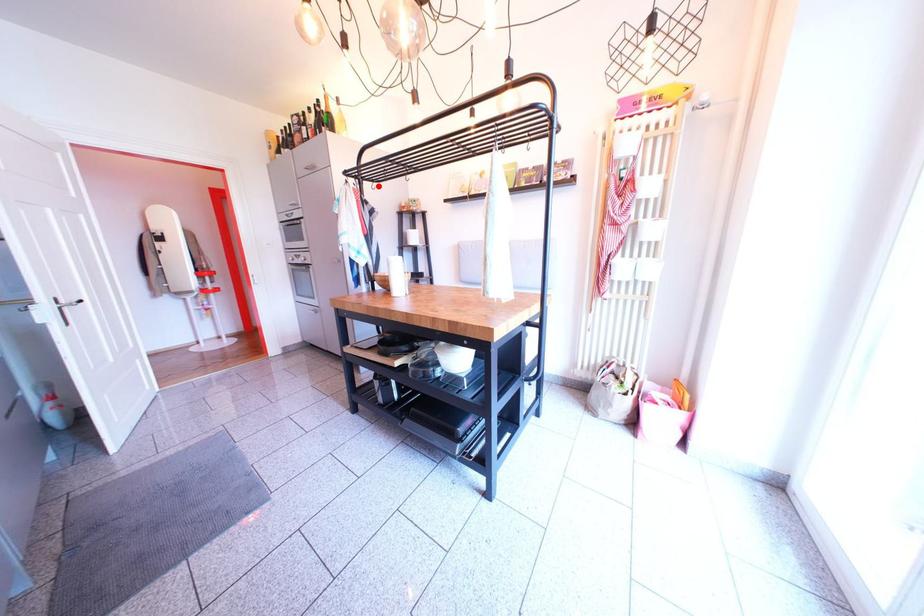
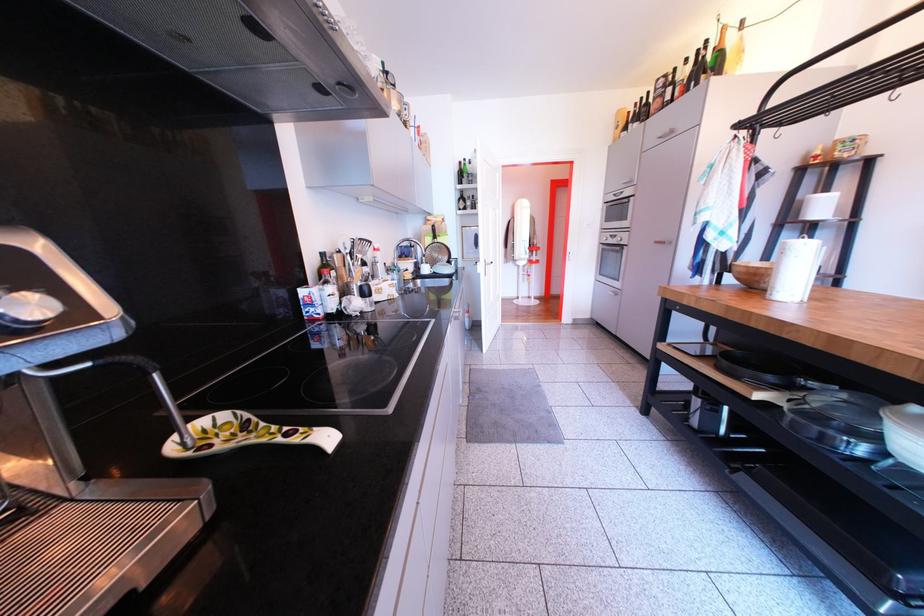
Locate, in the second image, the point that corresponds to the highlighted location in the first image.

(782, 132)